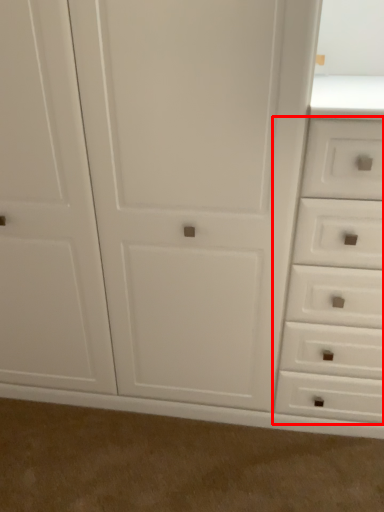
Question: From the image's perspective, what is the correct spatial relationship of drawer (annotated by the red box) in relation to plain?

Choices:
 (A) below
 (B) above

Answer: (B)